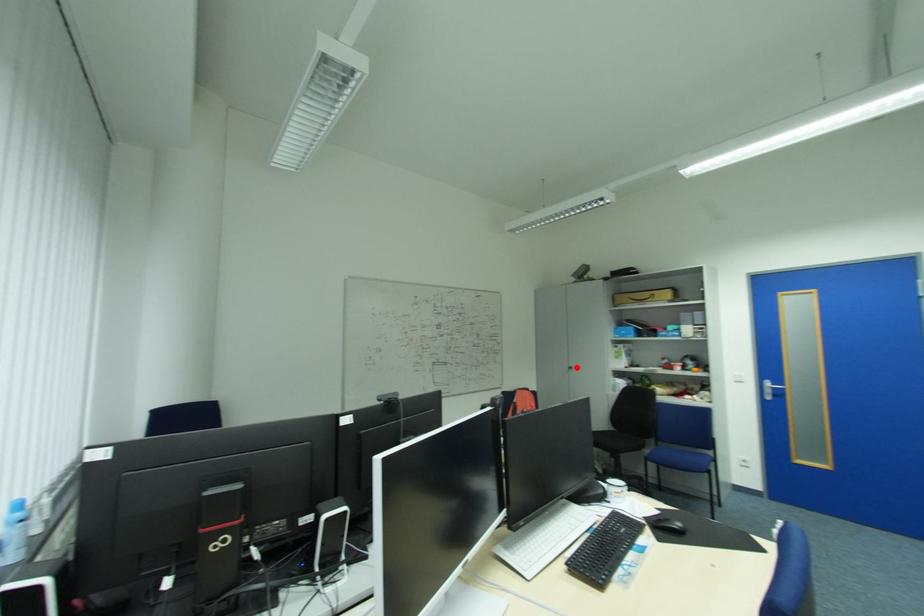
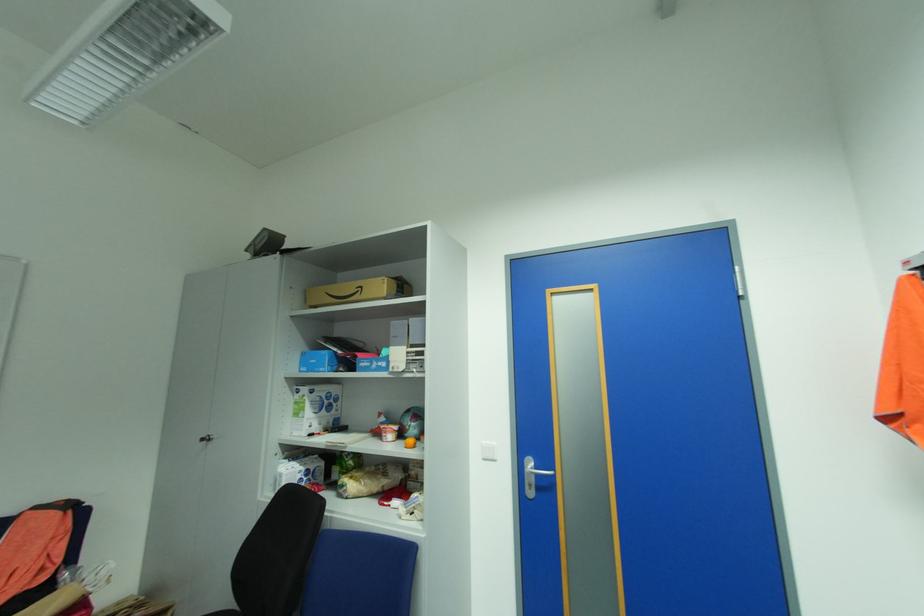
Where in the second image is the point corresponding to the highlighted location from the first image?

(213, 439)